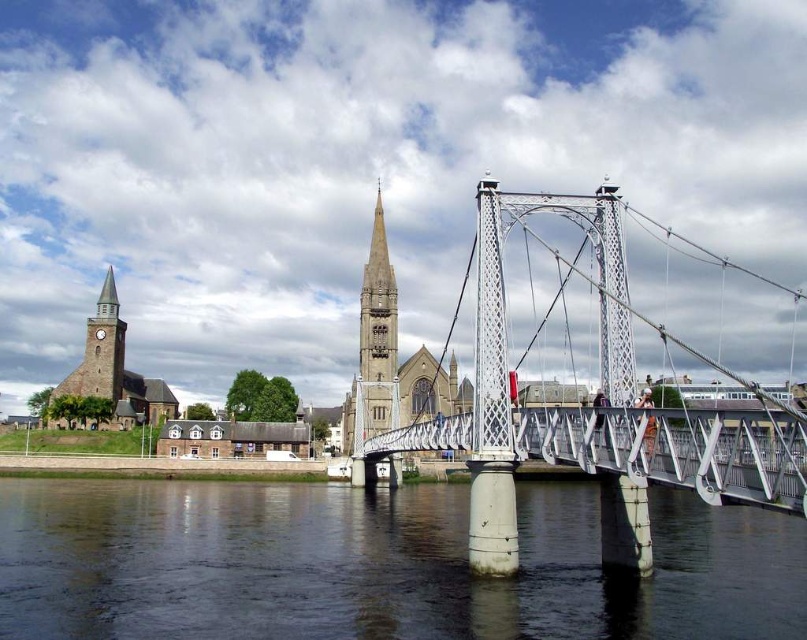
Question: Can you confirm if white metallic suspension bridge at center is wider than light gray stone spire at center?

Choices:
 (A) no
 (B) yes

Answer: (B)

Question: Can you confirm if white metallic suspension bridge at center is bigger than white metallic pedestrian bridge at center?

Choices:
 (A) yes
 (B) no

Answer: (A)

Question: Can you confirm if clear water at center is positioned to the right of white metallic suspension bridge at center?

Choices:
 (A) no
 (B) yes

Answer: (A)

Question: Estimate the real-world distances between objects in this image. Which object is closer to the white metallic pedestrian bridge at center?

Choices:
 (A) clear water at center
 (B) light gray stone spire at center
 (C) white metallic suspension bridge at center

Answer: (C)

Question: Based on their relative distances, which object is farther from the clear water at center?

Choices:
 (A) light gray stone spire at center
 (B) brown stone church at left
 (C) white metallic pedestrian bridge at center
 (D) white metallic suspension bridge at center

Answer: (B)

Question: Which of the following is the closest to the observer?

Choices:
 (A) coord(728,472)
 (B) coord(454,618)
 (C) coord(508,385)
 (D) coord(387,376)

Answer: (A)